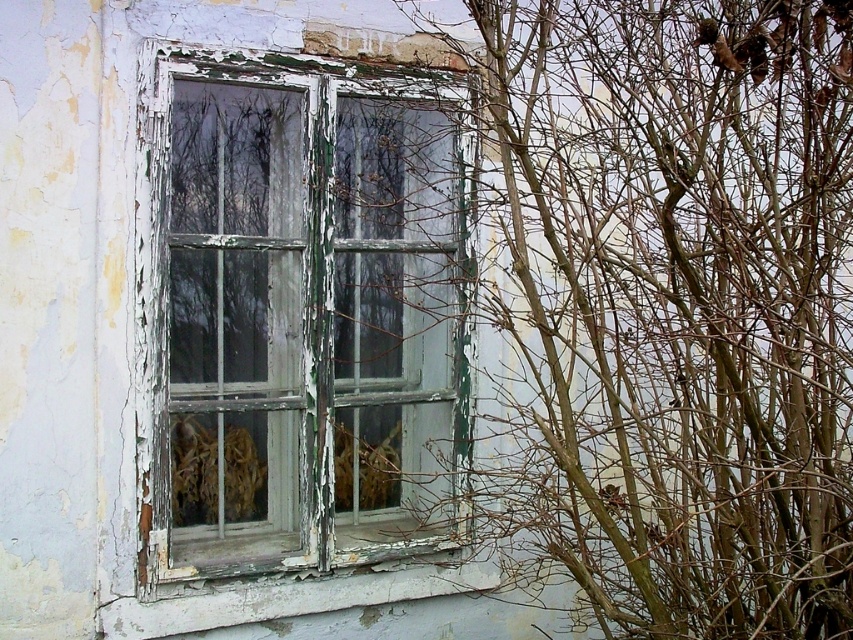
You are a painter assessing the condition of the building. You notice the green peeling paint window at center and the peeling white paint at lower center. Which area should you prioritize for repair first based on their positions?

The peeling white paint at lower center should be prioritized for repair first because it is positioned below the green peeling paint window at center, making it more vulnerable to water damage and deterioration from above.

Based on the photo, you are a window cleaner standing 5 feet away from the green peeling paint window at center. You want to clean the window but notice the bare branches at right nearby. Can you safely reach the window without touching the branches? Please explain your reasoning.

The distance between the bare branches at right and the green peeling paint window at center is 25.23 inches. Since you are standing 5 feet away from the window, which is approximately 60 inches, the branches are 25.23 inches away from the window. This means there is enough space between the window and the branches to safely reach the window without touching the branches.